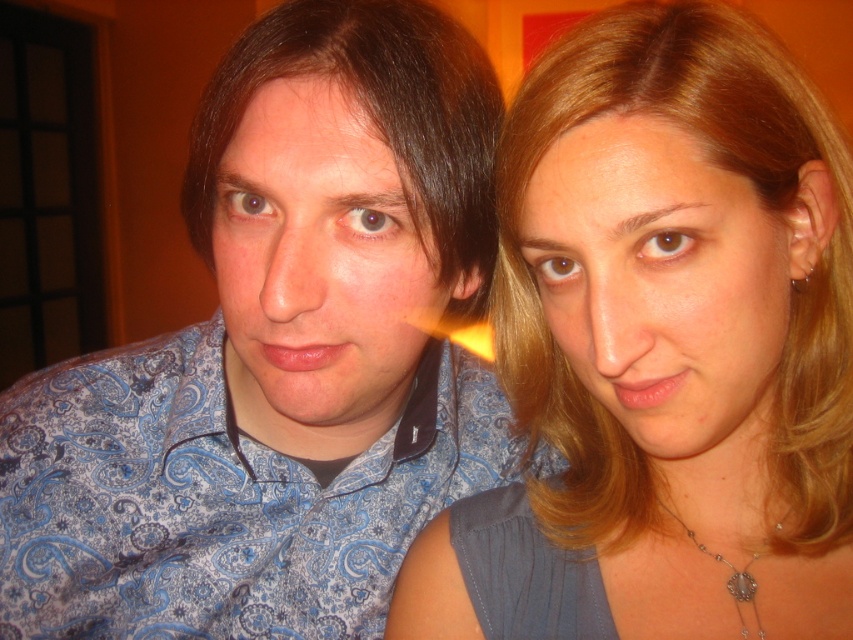
Does point (592, 176) come farther from viewer compared to point (268, 132)?

That is False.

Is smooth blonde hair at center behind matte blue shirt at left?

No, smooth blonde hair at center is closer to the viewer.

This screenshot has width=853, height=640. Find the location of `smooth blonde hair at center`. smooth blonde hair at center is located at coordinates (672, 337).

Find the location of a particular element. This screenshot has height=640, width=853. smooth blonde hair at center is located at coordinates (672, 337).

Is point (816, 349) farther from camera compared to point (693, 259)?

Yes, it is behind point (693, 259).

Who is taller, smooth blonde hair at center or blonde hair at right?

With more height is smooth blonde hair at center.

Is point (653, 204) positioned behind point (701, 440)?

No, it is not.

Locate an element on the screen. The image size is (853, 640). smooth blonde hair at center is located at coordinates (672, 337).

Does blue paisley shirt at center have a lesser width compared to smooth blonde hair at center?

No, blue paisley shirt at center is not thinner than smooth blonde hair at center.

Who is higher up, blue paisley shirt at center or smooth blonde hair at center?

Positioned higher is smooth blonde hair at center.

Between point (268, 296) and point (535, 188), which one is positioned behind?

The point (268, 296) is behind.

Identify the location of blue paisley shirt at center. (279, 355).